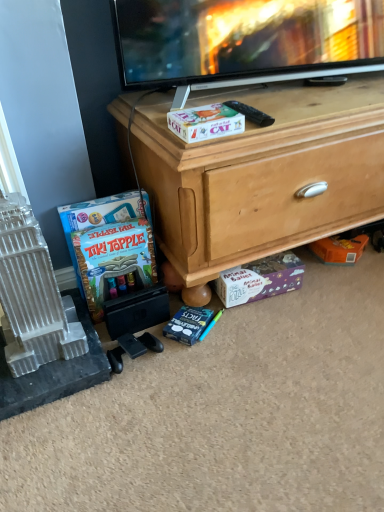
Locate an element on the screen. The image size is (384, 512). free space in front of matte board game at lower left is located at coordinates (142, 349).